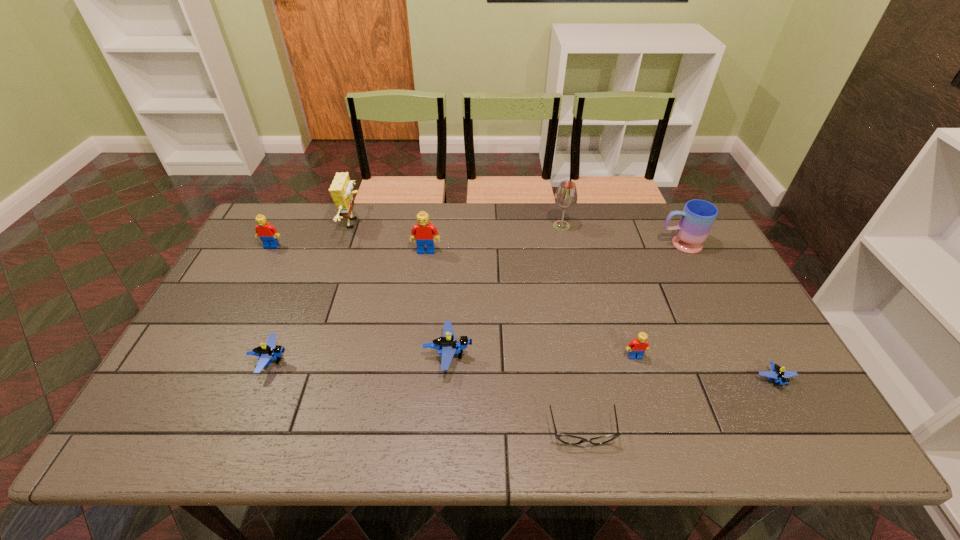
Locate an element on the screen. free space that satisfies the following two spatial constraints: 1. on the face of the second Lego from right to left; 2. on the front-facing side of the eighth tallest object is located at coordinates (636, 360).

Identify the location of vacant space that satisfies the following two spatial constraints: 1. on the face of the wineglass; 2. on the left side of the yellow sponge. The image size is (960, 540). (353, 226).

Where is `free space that satisfies the following two spatial constraints: 1. on the face of the yellow sponge; 2. on the face of the fifth tallest object`? free space that satisfies the following two spatial constraints: 1. on the face of the yellow sponge; 2. on the face of the fifth tallest object is located at coordinates (347, 246).